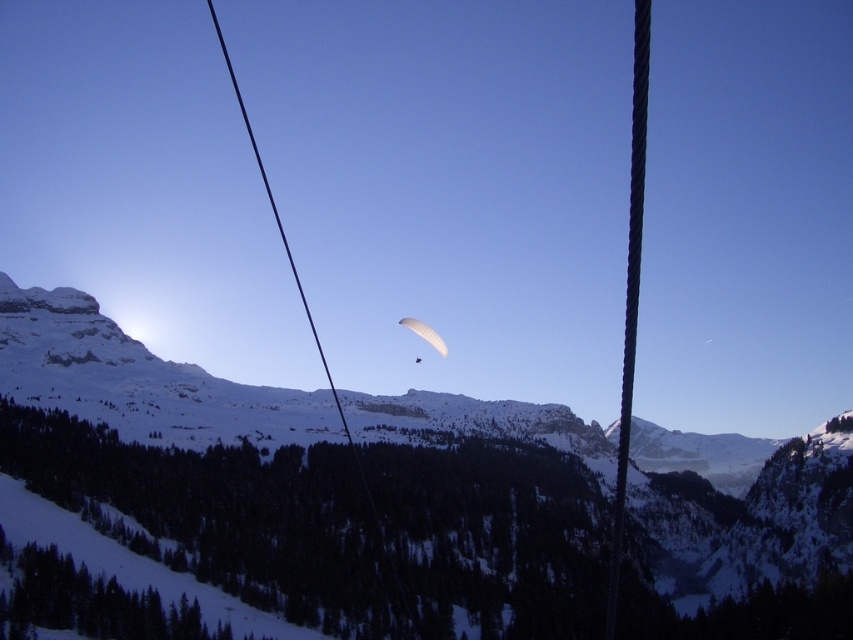
Who is shorter, snowy rocky mountain at center or white matte parachute at center?

Standing shorter between the two is white matte parachute at center.

Does snowy rocky mountain at center have a larger size compared to white matte parachute at center?

Correct, snowy rocky mountain at center is larger in size than white matte parachute at center.

I want to click on snowy rocky mountain at center, so click(287, 497).

Locate an element on the screen. snowy rocky mountain at center is located at coordinates (287, 497).

Based on the photo, which of these two, snowy rocky mountain at center or black rope at right, stands taller?

With more height is black rope at right.

Describe the element at coordinates (287, 497) in the screenshot. The width and height of the screenshot is (853, 640). I see `snowy rocky mountain at center` at that location.

This screenshot has width=853, height=640. I want to click on snowy rocky mountain at center, so click(x=287, y=497).

Is black rope at right bigger than black wire at center?

No.

Does black rope at right have a greater height compared to black wire at center?

Yes, black rope at right is taller than black wire at center.

Who is more forward, (637, 58) or (270, 205)?

Point (637, 58)

You are a GUI agent. You are given a task and a screenshot of the screen. Output one action in this format:
    pyautogui.click(x=<x>, y=<y>)
    Task: Click on the black rope at right
    The image size is (853, 640).
    Given the screenshot: What is the action you would take?
    pyautogui.click(x=630, y=289)